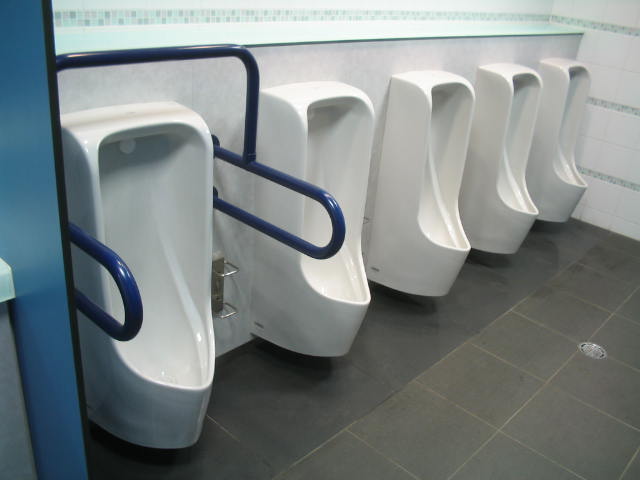
The width and height of the screenshot is (640, 480). What are the coordinates of `urinals` in the screenshot? It's located at (163, 260), (323, 286), (445, 236), (512, 196), (570, 191).